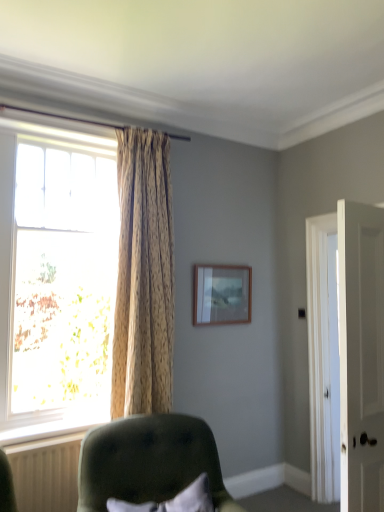
Question: Can you confirm if translucent glass window at left is thinner than wooden frame at upper center?

Choices:
 (A) yes
 (B) no

Answer: (B)

Question: Is wooden frame at upper center inside translucent glass window at left?

Choices:
 (A) yes
 (B) no

Answer: (B)

Question: Considering the relative sizes of translucent glass window at left and wooden frame at upper center in the image provided, is translucent glass window at left smaller than wooden frame at upper center?

Choices:
 (A) no
 (B) yes

Answer: (A)

Question: Does translucent glass window at left have a greater height compared to wooden frame at upper center?

Choices:
 (A) no
 (B) yes

Answer: (B)

Question: Is translucent glass window at left not close to wooden frame at upper center?

Choices:
 (A) no
 (B) yes

Answer: (B)

Question: Is point (215, 314) positioned closer to the camera than point (115, 446)?

Choices:
 (A) farther
 (B) closer

Answer: (A)

Question: From a real-world perspective, relative to velvet green chair at lower center, is wooden frame at upper center vertically above or below?

Choices:
 (A) below
 (B) above

Answer: (B)

Question: In terms of height, does wooden frame at upper center look taller or shorter compared to velvet green chair at lower center?

Choices:
 (A) tall
 (B) short

Answer: (B)

Question: Relative to velvet green chair at lower center, is wooden frame at upper center in front or behind?

Choices:
 (A) behind
 (B) front

Answer: (A)

Question: In the image, is white plastic radiator at lower left on the left side or the right side of wooden frame at upper center?

Choices:
 (A) right
 (B) left

Answer: (B)

Question: From their relative heights in the image, would you say white plastic radiator at lower left is taller or shorter than wooden frame at upper center?

Choices:
 (A) tall
 (B) short

Answer: (B)

Question: Is white plastic radiator at lower left wider or thinner than wooden frame at upper center?

Choices:
 (A) thin
 (B) wide

Answer: (A)

Question: From the image's perspective, is white plastic radiator at lower left above or below wooden frame at upper center?

Choices:
 (A) below
 (B) above

Answer: (A)

Question: From a real-world perspective, is white plastic radiator at lower left positioned above or below translucent glass window at left?

Choices:
 (A) above
 (B) below

Answer: (B)

Question: In terms of width, does white plastic radiator at lower left look wider or thinner when compared to translucent glass window at left?

Choices:
 (A) wide
 (B) thin

Answer: (B)